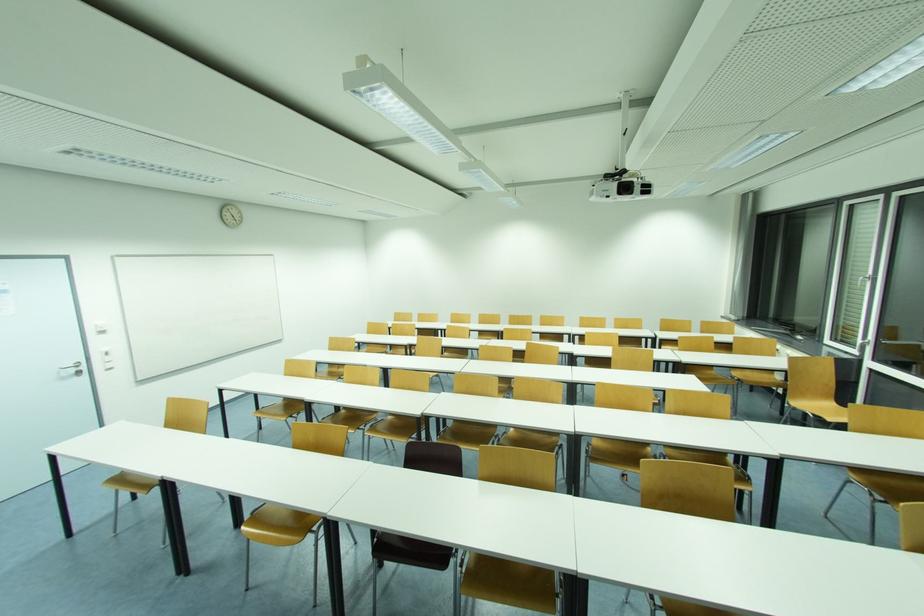
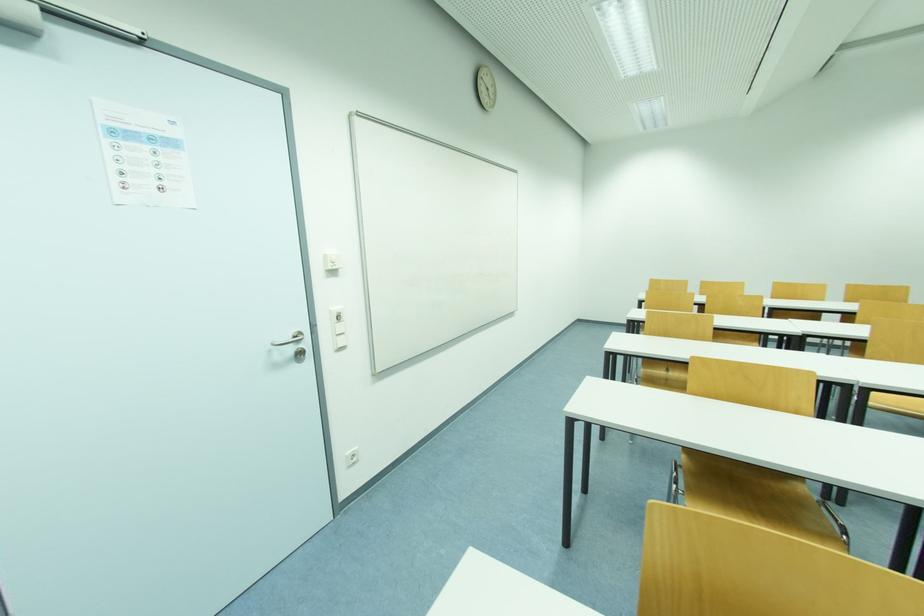
What movement of the cameraman would produce the second image?

The cameraman moved toward left, forward.